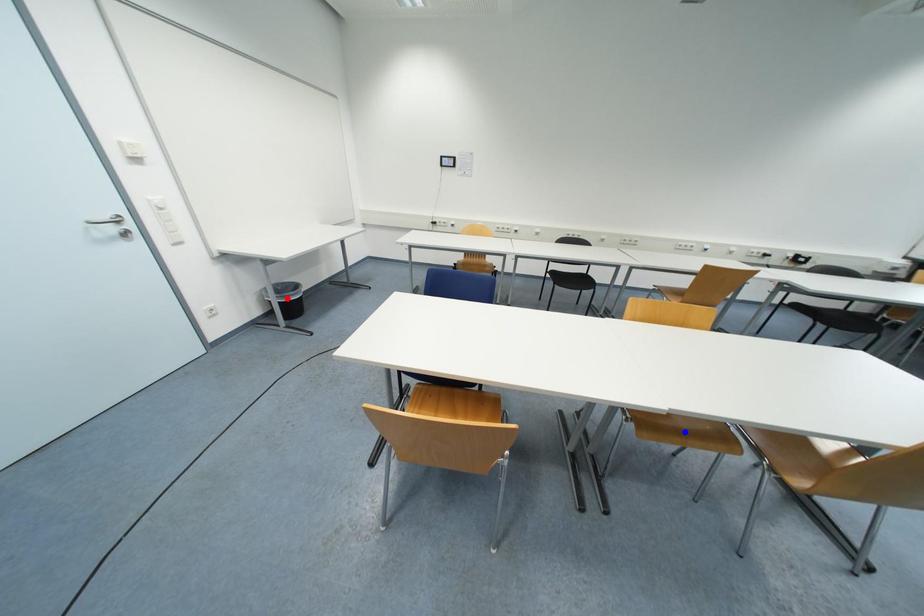
Question: Which of the two points in the image is closer to the camera?

Choices:
 (A) Blue point is closer.
 (B) Red point is closer.

Answer: (A)